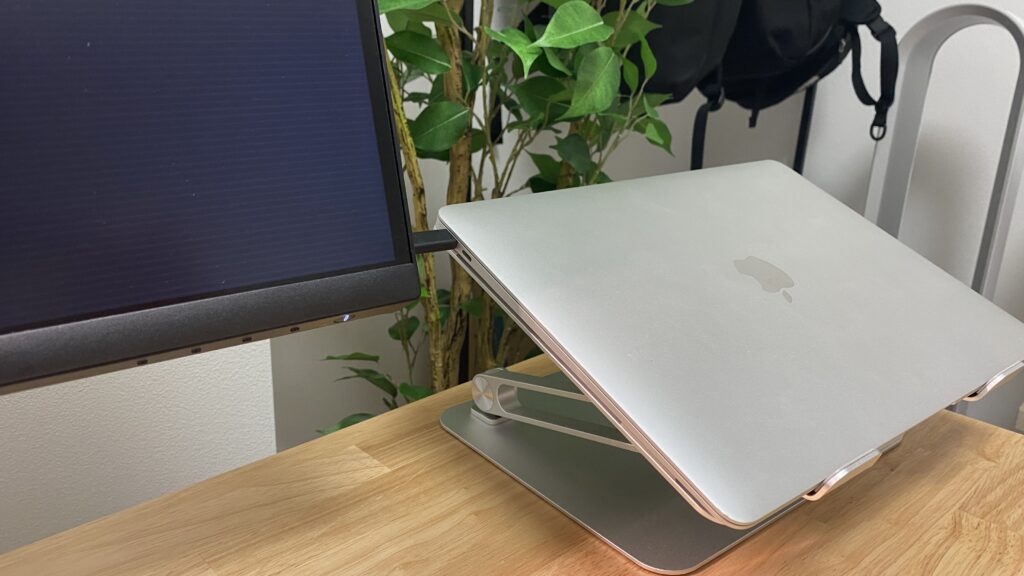
The width and height of the screenshot is (1024, 576). What are the coordinates of `stand base` in the screenshot? It's located at (568, 485).